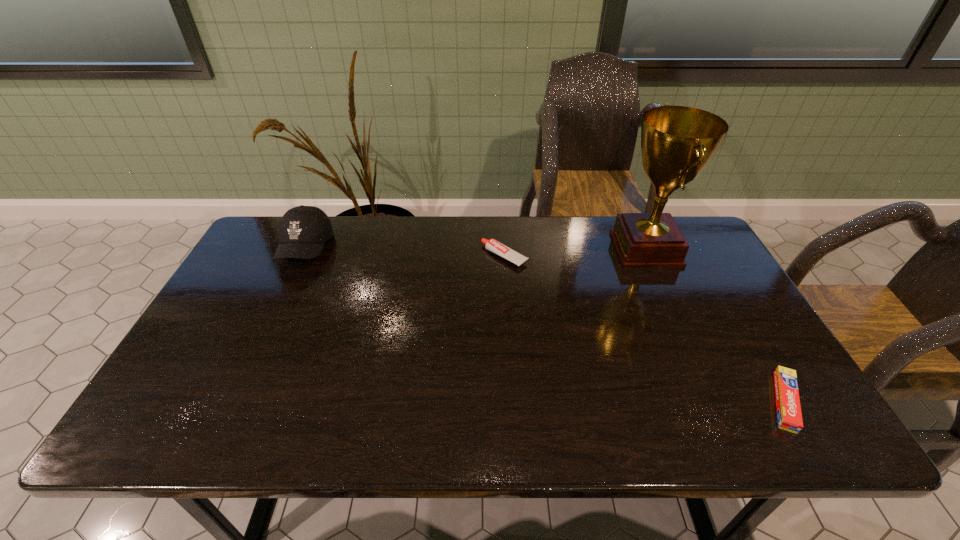
Locate an element on the screen. Image resolution: width=960 pixels, height=540 pixels. free spot between the right toothpaste and the third object from left to right is located at coordinates (715, 325).

Locate an element on the screen. This screenshot has width=960, height=540. unoccupied position between the leftmost object and the right toothpaste is located at coordinates (545, 325).

Locate an element on the screen. vacant space that is in between the award and the third shortest object is located at coordinates (475, 248).

You are a GUI agent. You are given a task and a screenshot of the screen. Output one action in this format:
    pyautogui.click(x=<x>, y=<y>)
    Task: Click on the free space between the leftmost object and the nearest object
    This screenshot has width=960, height=540.
    Given the screenshot: What is the action you would take?
    pyautogui.click(x=545, y=325)

Where is `empty space that is in between the shortest object and the second object from right to left`? The height and width of the screenshot is (540, 960). empty space that is in between the shortest object and the second object from right to left is located at coordinates click(x=715, y=325).

The height and width of the screenshot is (540, 960). Find the location of `empty space between the rightmost object and the third shortest object`. empty space between the rightmost object and the third shortest object is located at coordinates (545, 325).

Find the location of a particular element. Image resolution: width=960 pixels, height=540 pixels. free space between the third tallest object and the nearest object is located at coordinates (644, 329).

I want to click on vacant area between the third object from left to right and the baseball cap, so click(475, 248).

What are the coordinates of `vacant area that lies between the third object from left to right and the shortest object` in the screenshot? It's located at (715, 325).

Locate which object is the closest to the third object from left to right. Please provide its 2D coordinates. Your answer should be formatted as a tuple, i.e. [(x, y)], where the tuple contains the x and y coordinates of a point satisfying the conditions above.

[(492, 245)]